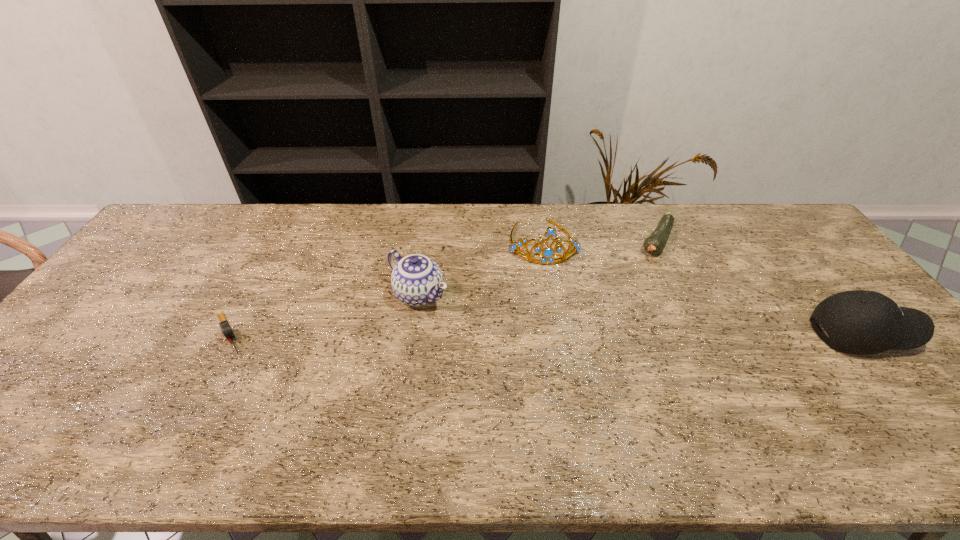
In the image, there is a desktop. At what (x,y) coordinates should I click in order to perform the action: click on free region at the far edge. Please return your answer as a coordinate pair (x, y). Looking at the image, I should click on (448, 216).

Where is `free spot at the near edge of the desktop`? The width and height of the screenshot is (960, 540). free spot at the near edge of the desktop is located at coordinates (x=313, y=413).

In the image, there is a desktop. What are the coordinates of `free space at the left edge` in the screenshot? It's located at (153, 294).

Locate an element on the screen. The image size is (960, 540). blank space at the far right corner of the desktop is located at coordinates (764, 210).

Identify the location of free space between the third object from left to right and the second object from left to right. (481, 268).

Locate an element on the screen. The width and height of the screenshot is (960, 540). free space between the second object from left to right and the third object from right to left is located at coordinates (481, 268).

The image size is (960, 540). I want to click on free space that is in between the baseball cap and the shortest object, so click(546, 334).

What are the coordinates of `empty location between the second object from left to right and the zucchini` in the screenshot? It's located at (538, 268).

At what (x,y) coordinates should I click in order to perform the action: click on blank region between the tape measure and the fourth object from right to left. Please return your answer as a coordinate pair (x, y). Image resolution: width=960 pixels, height=540 pixels. Looking at the image, I should click on (324, 314).

Find the location of a particular element. empty space between the rightmost object and the zucchini is located at coordinates (759, 287).